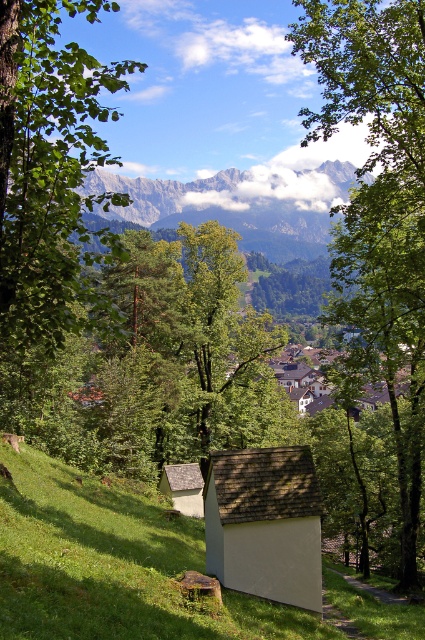
Question: Which is nearer to the white shingled hut at center?

Choices:
 (A) green leafy tree at center
 (B) white wood hut at lower center

Answer: (A)

Question: Which is nearer to the white shingled hut at center?

Choices:
 (A) green grassy at lower left
 (B) green leafy tree at left

Answer: (A)

Question: Considering the real-world distances, which object is farthest from the white wood hut at lower center?

Choices:
 (A) green leafy tree at left
 (B) green grassy at lower left
 (C) white shingled hut at center

Answer: (A)

Question: Can you confirm if green leafy tree at center is bigger than green leafy tree at left?

Choices:
 (A) no
 (B) yes

Answer: (B)

Question: In this image, where is green leafy tree at left located relative to white shingled hut at center?

Choices:
 (A) right
 (B) left

Answer: (B)

Question: Does green leafy tree at left appear on the left side of brown wooden picnic table at lower center?

Choices:
 (A) no
 (B) yes

Answer: (B)